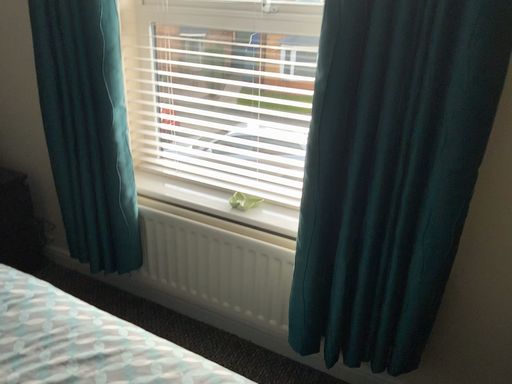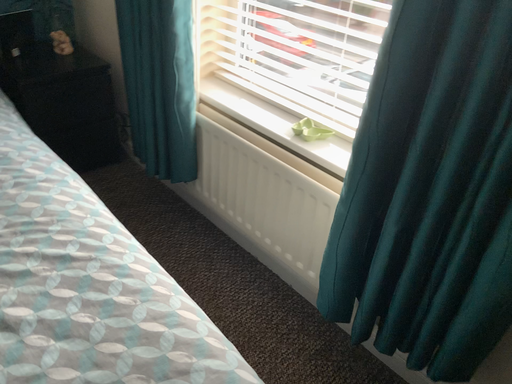
Question: Which way did the camera rotate in the video?

Choices:
 (A) rotated downward
 (B) rotated upward

Answer: (A)